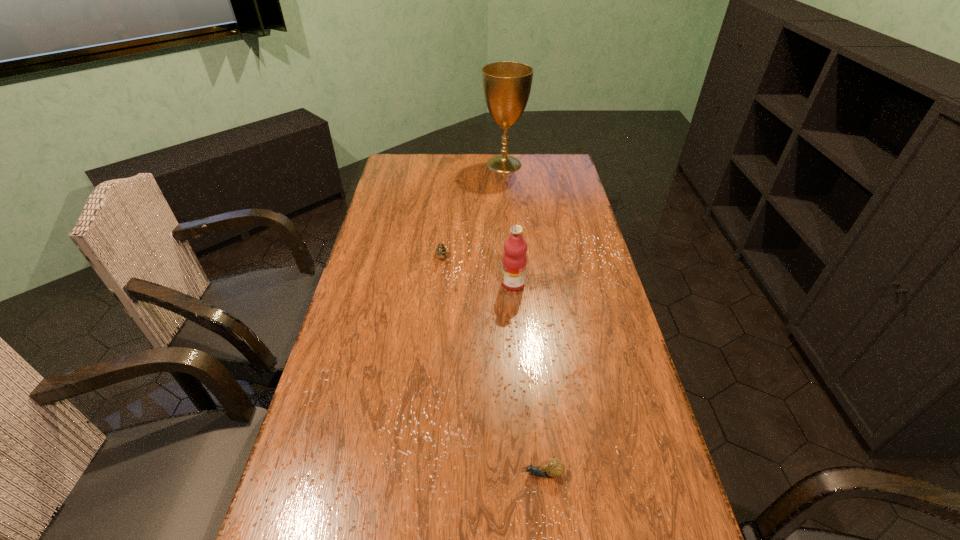
The width and height of the screenshot is (960, 540). Identify the location of free location at the far left corner of the desktop. (412, 161).

Identify the location of vacant area at the far right corner of the desktop. (547, 162).

Where is `vacant space that is in between the second nearest object and the right escargot`? vacant space that is in between the second nearest object and the right escargot is located at coordinates (528, 379).

You are a GUI agent. You are given a task and a screenshot of the screen. Output one action in this format:
    pyautogui.click(x=<x>, y=<y>)
    Task: Click on the vacant area between the farthest object and the third farthest object
    This screenshot has height=540, width=960.
    Given the screenshot: What is the action you would take?
    pyautogui.click(x=509, y=224)

Locate an element on the screen. The image size is (960, 540). empty location between the leftmost object and the tallest object is located at coordinates (473, 211).

The height and width of the screenshot is (540, 960). What are the coordinates of `vacant region between the left escargot and the second tallest object` in the screenshot? It's located at (477, 271).

Locate an element on the screen. This screenshot has width=960, height=540. free space between the tallest object and the shortest object is located at coordinates (523, 319).

Identify the location of vacant space in between the third farthest object and the right escargot. The width and height of the screenshot is (960, 540). (528, 379).

Find the location of a particular element. free spot between the shorter escargot and the taller escargot is located at coordinates (492, 366).

Find the location of a particular element. unoccupied area between the right escargot and the trophy cup is located at coordinates (523, 319).